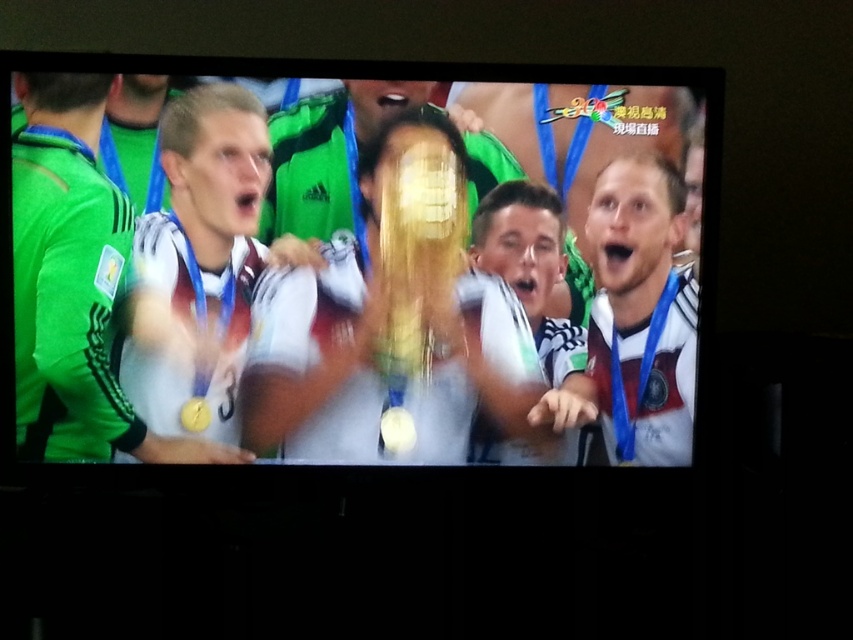
Who is lower down, white matte jersey at right or white matte jersey at center?

white matte jersey at center is lower down.

Between point (637, 296) and point (520, 458), which one is positioned behind?

Point (520, 458)

Which is in front, point (630, 163) or point (537, 452)?

Point (630, 163)

The image size is (853, 640). Identify the location of white matte jersey at right. (635, 321).

Based on the photo, can you confirm if shiny silver trophy at center is positioned below white matte jersey at center?

No, shiny silver trophy at center is not below white matte jersey at center.

Is shiny silver trophy at center wider than white matte jersey at center?

Yes.

What do you see at coordinates (329, 326) in the screenshot? I see `shiny silver trophy at center` at bounding box center [329, 326].

Identify the location of shiny silver trophy at center. (329, 326).

Between shiny silver trophy at center and gold shiny medal at center, which one appears on the left side from the viewer's perspective?

Positioned to the left is gold shiny medal at center.

Is shiny silver trophy at center taller than gold shiny medal at center?

Indeed, shiny silver trophy at center has a greater height compared to gold shiny medal at center.

Is point (363, 202) in front of point (183, 426)?

No, it is behind (183, 426).

The height and width of the screenshot is (640, 853). I want to click on shiny silver trophy at center, so [329, 326].